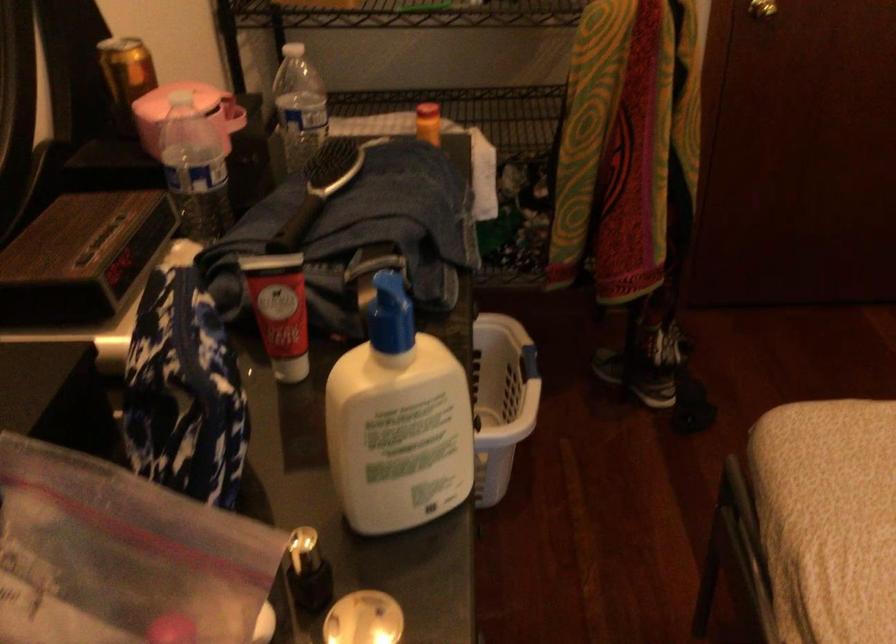
Where is `brass door knob`? brass door knob is located at coordinates (762, 8).